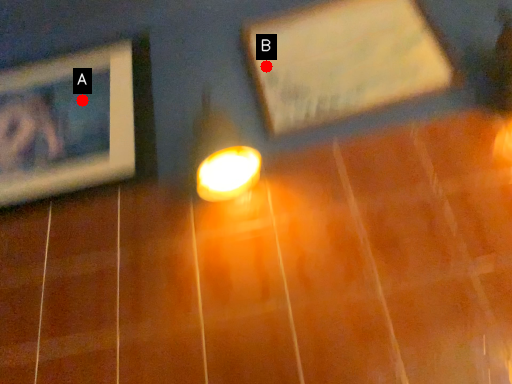
Question: Two points are circled on the image, labeled by A and B beside each circle. Which of the following is the closest to the observer?

Choices:
 (A) A is closer
 (B) B is closer

Answer: (B)